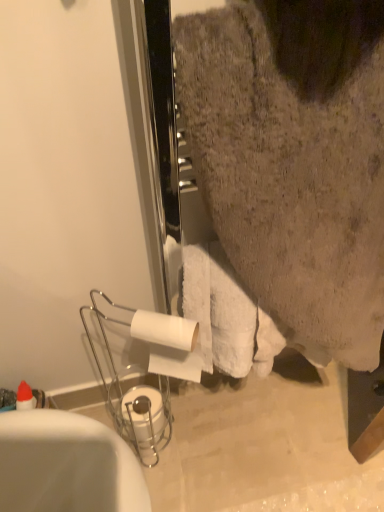
Question: Which is correct: white matte toilet paper at lower center, arranged as the 1th toilet paper when ordered from the bottom, is inside white fluffy towel at upper right, or outside of it?

Choices:
 (A) outside
 (B) inside

Answer: (A)

Question: From a real-world perspective, is white matte toilet paper at lower center, marked as the first toilet paper in a back-to-front arrangement, physically located above or below white fluffy towel at upper right?

Choices:
 (A) below
 (B) above

Answer: (A)

Question: Considering the real-world distances, which object is farthest from the white fluffy towel at upper right?

Choices:
 (A) white matte toilet paper at center, the first toilet paper when ordered from front to back
 (B) white glossy bathtub at lower left
 (C) white matte toilet paper at lower center, marked as the first toilet paper in a back-to-front arrangement

Answer: (C)

Question: Based on their relative distances, which object is nearer to the white matte toilet paper at center, which is counted as the second toilet paper, starting from the bottom?

Choices:
 (A) white matte toilet paper at lower center, marked as the first toilet paper in a back-to-front arrangement
 (B) white glossy bathtub at lower left
 (C) white fluffy towel at upper right

Answer: (B)